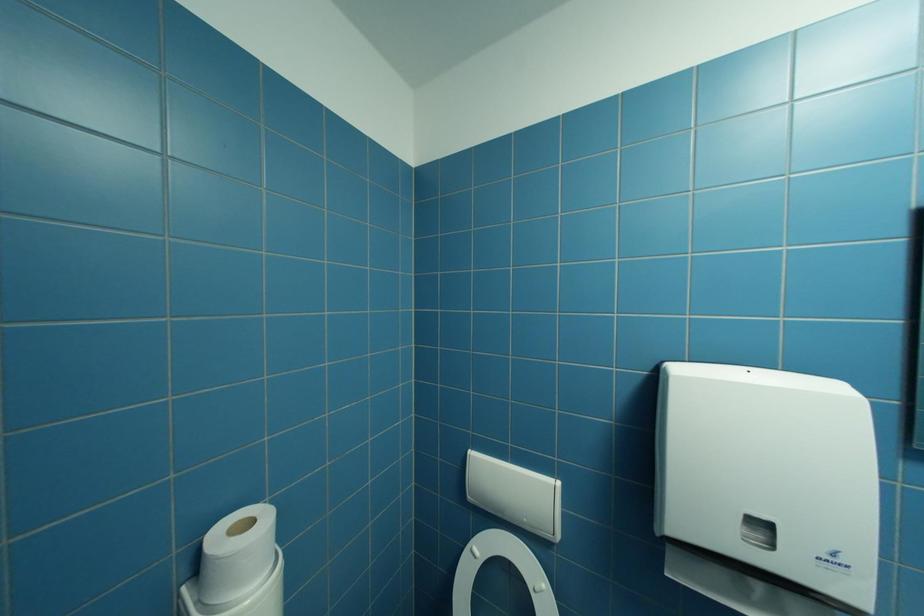
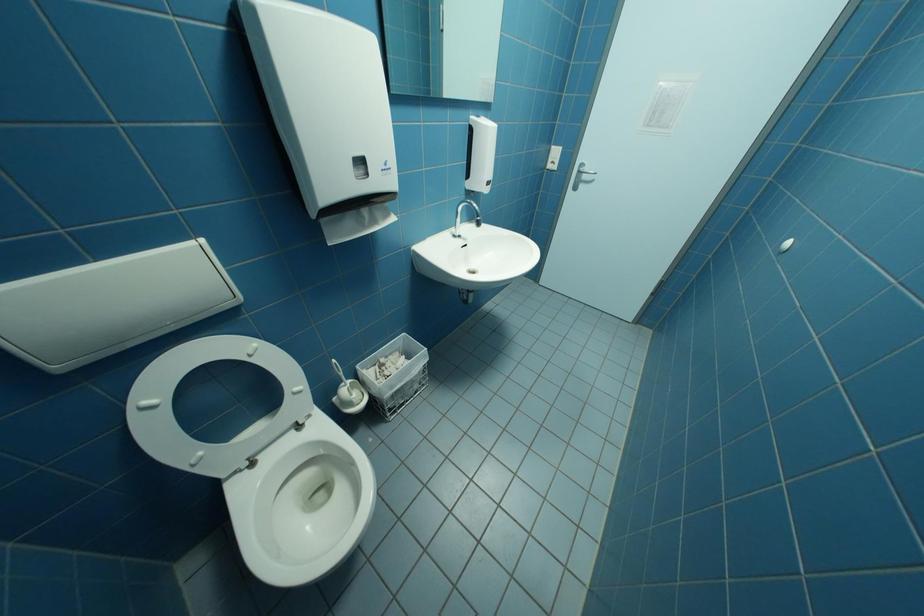
How did the camera likely rotate?

The rotation direction of the camera is right-down.